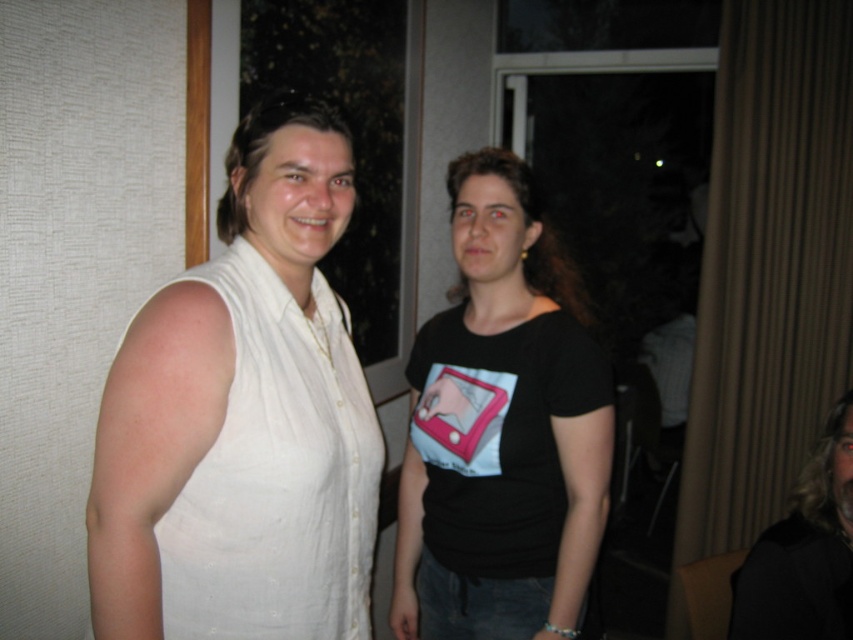
Between white linen dress at left and black matte hair at upper right, which one is positioned higher?

white linen dress at left

Does white linen dress at left appear under black matte hair at upper right?

No.

Where is `white linen dress at left`? The image size is (853, 640). white linen dress at left is located at coordinates (277, 474).

Which is behind, point (556, 291) or point (776, 564)?

The point (556, 291) is more distant.

I want to click on black matte t-shirt at center, so click(502, 429).

Between black matte t-shirt at center and white linen dress at left, which one is positioned higher?

Positioned higher is black matte t-shirt at center.

Does black matte t-shirt at center have a greater width compared to white linen dress at left?

Indeed, black matte t-shirt at center has a greater width compared to white linen dress at left.

Who is more forward, (x=553, y=593) or (x=328, y=289)?

Point (x=328, y=289) is more forward.

In order to click on black matte t-shirt at center in this screenshot , I will do `click(502, 429)`.